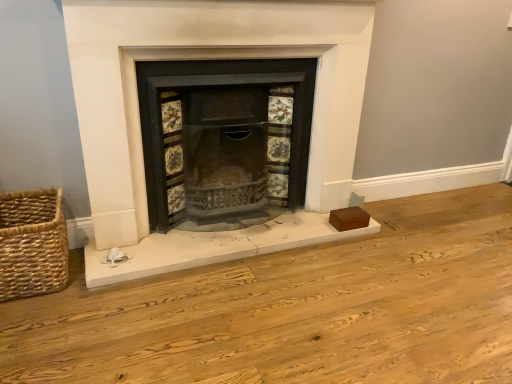
Describe the element at coordinates (32, 244) in the screenshot. I see `woven straw basket at lower left` at that location.

From the picture: Measure the distance between black cast iron wood burning stove at center and camera.

1.92 meters.

Where is `matte black fireplace at center`? matte black fireplace at center is located at coordinates (199, 59).

Who is bigger, matte black fireplace at center or woven straw basket at lower left?

matte black fireplace at center.

Considering the positions of objects matte black fireplace at center and woven straw basket at lower left in the image provided, who is in front, matte black fireplace at center or woven straw basket at lower left?

matte black fireplace at center is in front.

Would you say matte black fireplace at center is to the left or to the right of woven straw basket at lower left in the picture?

Clearly, matte black fireplace at center is on the right of woven straw basket at lower left in the image.

Between matte black fireplace at center and woven straw basket at lower left, which one has more height?

With more height is matte black fireplace at center.

Is point (155, 152) behind point (28, 257)?

Yes, it is behind point (28, 257).

How many degrees apart are the facing directions of black cast iron wood burning stove at center and woven straw basket at lower left?

0.0425 degrees.

From a real-world perspective, does black cast iron wood burning stove at center sit lower than woven straw basket at lower left?

No, from a real-world perspective, black cast iron wood burning stove at center is not under woven straw basket at lower left.

Measure the distance from black cast iron wood burning stove at center to woven straw basket at lower left.

black cast iron wood burning stove at center is 25.97 inches away from woven straw basket at lower left.

Where is `fireplace above the woven straw basket at lower left (from a real-world perspective)`? The height and width of the screenshot is (384, 512). fireplace above the woven straw basket at lower left (from a real-world perspective) is located at coordinates (199, 59).

Between woven straw basket at lower left and matte black fireplace at center, which one has smaller width?

Result: woven straw basket at lower left.

From a real-world perspective, is woven straw basket at lower left positioned above or below matte black fireplace at center?

Clearly, from a real-world perspective, woven straw basket at lower left is below matte black fireplace at center.

Is point (54, 279) more distant than point (345, 54)?

No.

Consider the image. Is black cast iron wood burning stove at center oriented towards matte black fireplace at center?

Yes.

Would you say black cast iron wood burning stove at center is to the left or to the right of matte black fireplace at center in the picture?

Based on their positions, black cast iron wood burning stove at center is located to the left of matte black fireplace at center.

Is matte black fireplace at center completely or partially inside black cast iron wood burning stove at center?

Actually, matte black fireplace at center is outside black cast iron wood burning stove at center.

Measure the distance from black cast iron wood burning stove at center to matte black fireplace at center.

black cast iron wood burning stove at center is 6.52 inches from matte black fireplace at center.

Looking at this image, does matte black fireplace at center have a lesser width compared to black cast iron wood burning stove at center?

No, matte black fireplace at center is not thinner than black cast iron wood burning stove at center.

From the image's perspective, would you say matte black fireplace at center is positioned over black cast iron wood burning stove at center?

Answer: Correct, matte black fireplace at center appears higher than black cast iron wood burning stove at center in the image.

From a real-world perspective, does matte black fireplace at center sit lower than black cast iron wood burning stove at center?

Actually, matte black fireplace at center is physically above black cast iron wood burning stove at center in the real world.

Is woven straw basket at lower left oriented away from black cast iron wood burning stove at center?

woven straw basket at lower left is not turned away from black cast iron wood burning stove at center.

Consider the image. Which of these two, woven straw basket at lower left or black cast iron wood burning stove at center, is wider?

black cast iron wood burning stove at center.

Could you measure the distance between woven straw basket at lower left and black cast iron wood burning stove at center?

25.97 inches.

Can you confirm if woven straw basket at lower left is positioned to the right of black cast iron wood burning stove at center?

Incorrect, woven straw basket at lower left is not on the right side of black cast iron wood burning stove at center.

Where is `fireplace above the woven straw basket at lower left (from a real-world perspective)`? Image resolution: width=512 pixels, height=384 pixels. fireplace above the woven straw basket at lower left (from a real-world perspective) is located at coordinates (199, 59).

At what (x,y) coordinates should I click in order to perform the action: click on basket in front of the black cast iron wood burning stove at center. Please return your answer as a coordinate pair (x, y). This screenshot has height=384, width=512. Looking at the image, I should click on (32, 244).

Looking at the image, which one is located further to black cast iron wood burning stove at center, woven straw basket at lower left or matte black fireplace at center?

woven straw basket at lower left is further to black cast iron wood burning stove at center.

From the image, which object appears to be nearer to black cast iron wood burning stove at center, matte black fireplace at center or woven straw basket at lower left?

Among the two, matte black fireplace at center is located nearer to black cast iron wood burning stove at center.

From the image, which object appears to be nearer to matte black fireplace at center, black cast iron wood burning stove at center or woven straw basket at lower left?

black cast iron wood burning stove at center is closer to matte black fireplace at center.

Looking at the image, which one is located closer to woven straw basket at lower left, matte black fireplace at center or black cast iron wood burning stove at center?

matte black fireplace at center lies closer to woven straw basket at lower left than the other object.

Considering their positions, is woven straw basket at lower left positioned further to matte black fireplace at center than black cast iron wood burning stove at center?

woven straw basket at lower left.

Which object lies further to the anchor point woven straw basket at lower left, black cast iron wood burning stove at center or matte black fireplace at center?

The object further to woven straw basket at lower left is black cast iron wood burning stove at center.

At what (x,y) coordinates should I click in order to perform the action: click on wood burning stove between woven straw basket at lower left and matte black fireplace at center in the horizontal direction. Please return your answer as a coordinate pair (x, y). The height and width of the screenshot is (384, 512). Looking at the image, I should click on (214, 85).